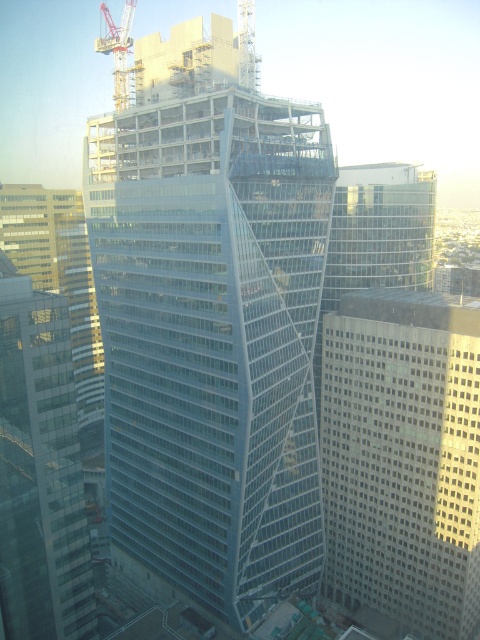
Question: Can you confirm if gray concrete building at center is positioned to the right of clear glass skyscraper at left?

Choices:
 (A) no
 (B) yes

Answer: (B)

Question: Does glassy steel skyscraper at center appear on the right side of metallic yellow crane at upper left?

Choices:
 (A) yes
 (B) no

Answer: (A)

Question: Which object is the farthest from the gray concrete building at center?

Choices:
 (A) clear glass skyscraper at left
 (B) metallic yellow crane at upper left

Answer: (B)

Question: Does gray concrete building at center have a larger size compared to clear glass skyscraper at left?

Choices:
 (A) yes
 (B) no

Answer: (A)

Question: Which point is closer to the camera taking this photo?

Choices:
 (A) (404, 436)
 (B) (183, 280)
 (C) (14, 612)

Answer: (C)

Question: Which point is farther to the camera?

Choices:
 (A) (252, 472)
 (B) (104, 3)
 (C) (420, 522)

Answer: (B)